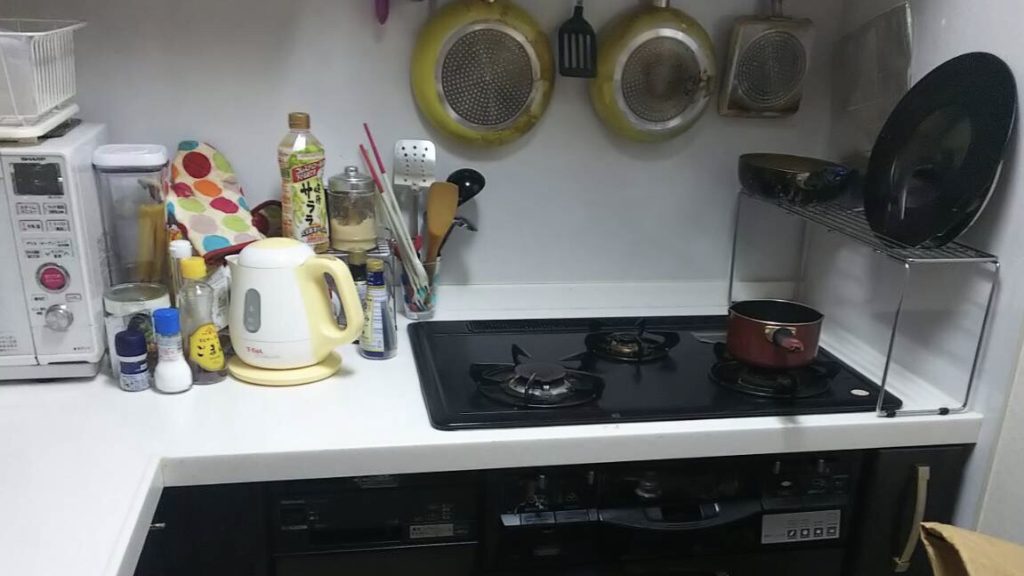
At what (x,y) coordinates should I click in order to perform the action: click on wall. Please return your answer as a coordinate pair (x, y). This screenshot has width=1024, height=576. Looking at the image, I should click on coord(231,62), coord(592,242), coord(966,29), coord(1006,479).